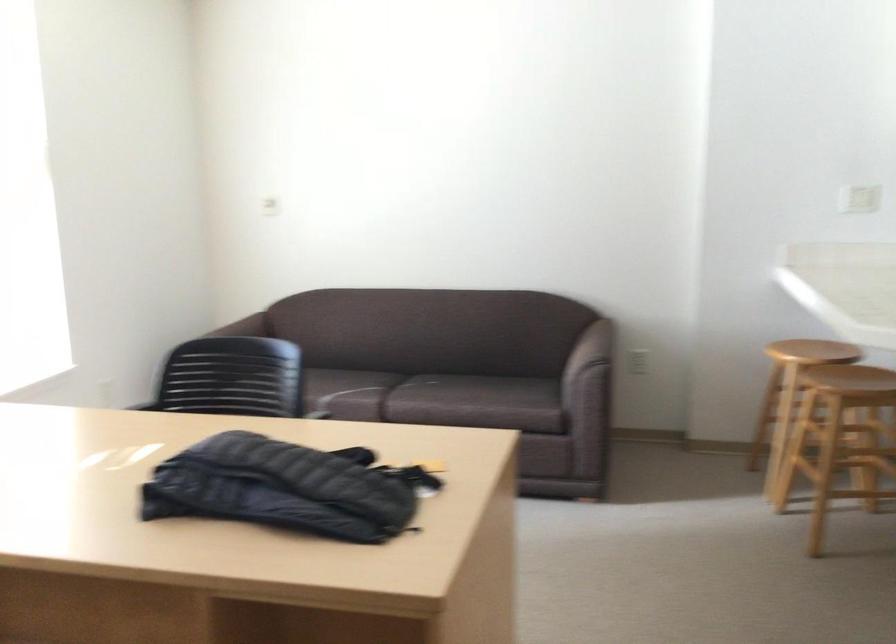
This screenshot has width=896, height=644. What do you see at coordinates (858, 198) in the screenshot? I see `the white light switch` at bounding box center [858, 198].